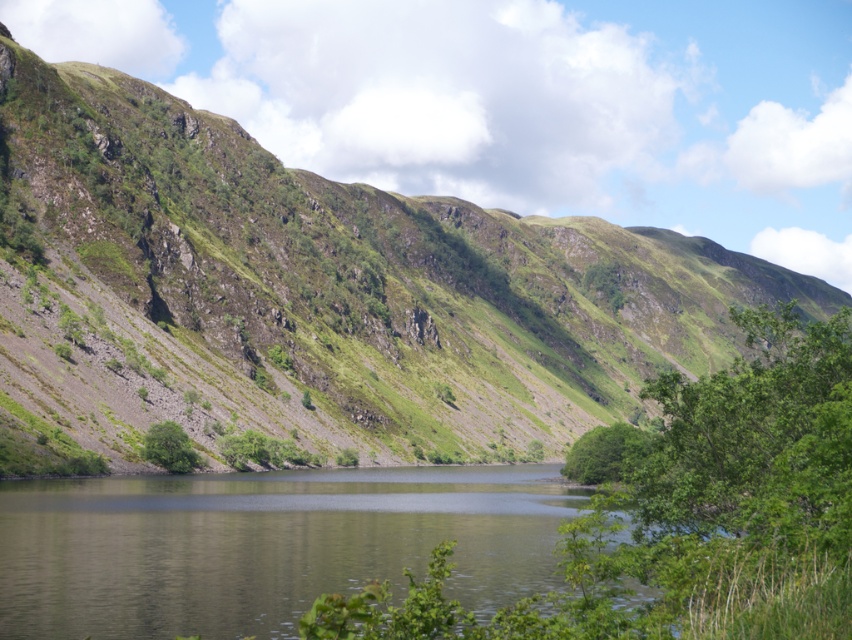
You are standing at the edge of the lake and want to reach the green leafy tree at lower left without getting your feet wet. The greenish water at center is in your way. Can you walk around the water to reach the tree?

The greenish water at center is 20.44 meters away from the green leafy tree at lower left. Since the water is between you and the tree, you can walk around the edge of the lake to reach the tree without stepping into the water.

From the picture: You are standing at the edge of the lake and want to reach the green leafy tree at center. Which direction should you head towards from your current position?

The green leafy tree at center is located at point (609, 452), so you should head towards the center of the image from the edge of the lake to reach it.